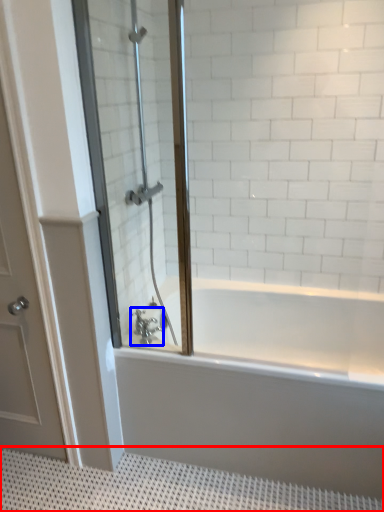
Question: Which object appears closest to the camera in this image, bath mat (highlighted by a red box) or tap (highlighted by a blue box)?

Choices:
 (A) bath mat
 (B) tap

Answer: (A)